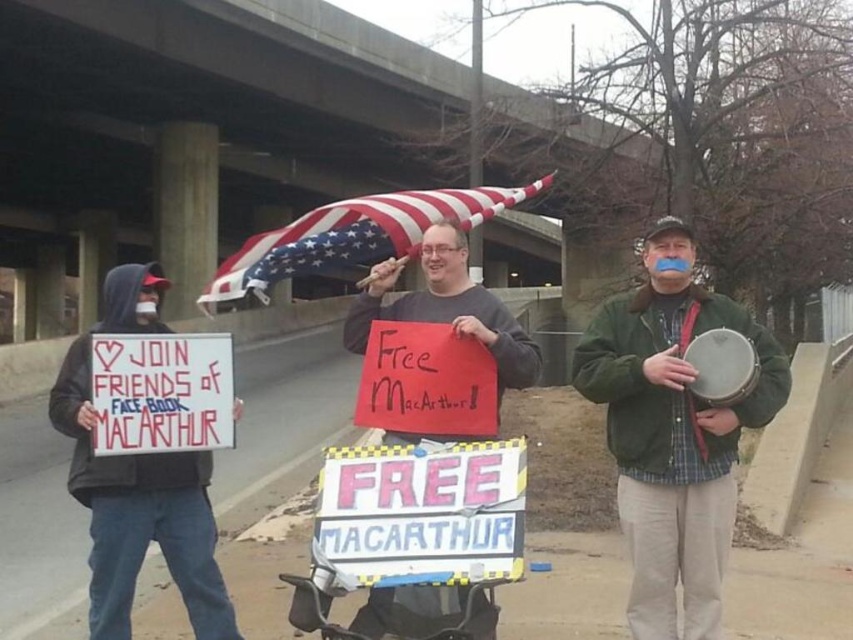
Question: Which object is positioned closest to the black hoodie at left?

Choices:
 (A) green fabric drum at center
 (B) matte black sign at center
 (C) american flag at center

Answer: (A)

Question: Is green fabric drum at center closer to the viewer compared to american flag at center?

Choices:
 (A) no
 (B) yes

Answer: (B)

Question: From the image, what is the correct spatial relationship of green fabric drum at center in relation to american flag at center?

Choices:
 (A) above
 (B) below

Answer: (B)

Question: Does green fabric drum at center have a smaller size compared to black hoodie at left?

Choices:
 (A) yes
 (B) no

Answer: (A)

Question: Which point appears closest to the camera in this image?

Choices:
 (A) (286, 237)
 (B) (213, 532)
 (C) (405, 600)
 (D) (647, 388)

Answer: (C)

Question: Based on their relative distances, which object is nearer to the american flag at center?

Choices:
 (A) green fabric drum at center
 (B) black hoodie at left
 (C) matte black sign at center

Answer: (A)